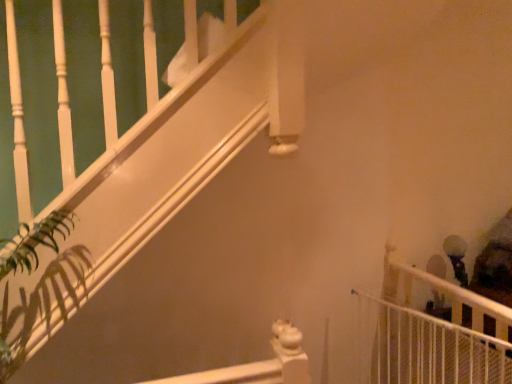
Image resolution: width=512 pixels, height=384 pixels. Describe the element at coordinates (435, 333) in the screenshot. I see `white mesh rail at lower right` at that location.

Where is `white mesh rail at lower right`? This screenshot has width=512, height=384. white mesh rail at lower right is located at coordinates (435, 333).

The height and width of the screenshot is (384, 512). Identify the location of white mesh rail at lower right. (x=435, y=333).